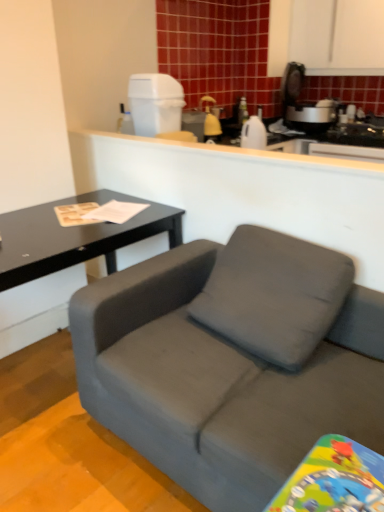
Question: Is matte yellow spray bottle at upper center, the 2th appliance from the front, in front of matte gray couch at center?

Choices:
 (A) no
 (B) yes

Answer: (A)

Question: Does matte yellow spray bottle at upper center, the first appliance from the right, have a lesser width compared to matte gray couch at center?

Choices:
 (A) no
 (B) yes

Answer: (B)

Question: Considering the relative positions of matte yellow spray bottle at upper center, which appears as the 2th appliance when viewed from the left, and matte gray couch at center in the image provided, is matte yellow spray bottle at upper center, which appears as the 2th appliance when viewed from the left, behind matte gray couch at center?

Choices:
 (A) yes
 (B) no

Answer: (A)

Question: Is matte yellow spray bottle at upper center, acting as the 1th appliance starting from the back, next to matte gray couch at center and touching it?

Choices:
 (A) yes
 (B) no

Answer: (B)

Question: From a real-world perspective, is matte yellow spray bottle at upper center, which appears as the 2th appliance when viewed from the left, below matte gray couch at center?

Choices:
 (A) yes
 (B) no

Answer: (B)

Question: From the image's perspective, is matte gray couch at center above or below white plastic trash can at upper center, positioned as the 1th appliance in left-to-right order?

Choices:
 (A) above
 (B) below

Answer: (B)

Question: From a real-world perspective, is matte gray couch at center physically located above or below white plastic trash can at upper center, positioned as the 1th appliance in left-to-right order?

Choices:
 (A) below
 (B) above

Answer: (A)

Question: Is matte gray couch at center bigger or smaller than white plastic trash can at upper center, which is counted as the 1th appliance, starting from the front?

Choices:
 (A) big
 (B) small

Answer: (A)

Question: Is matte gray couch at center inside or outside of white plastic trash can at upper center, placed as the second appliance when sorted from back to front?

Choices:
 (A) outside
 (B) inside

Answer: (A)

Question: From the image's perspective, is black matte table at left above or below matte yellow spray bottle at upper center, which appears as the 2th appliance when viewed from the left?

Choices:
 (A) above
 (B) below

Answer: (B)

Question: Looking at their shapes, would you say black matte table at left is wider or thinner than matte yellow spray bottle at upper center, the 2th appliance from the front?

Choices:
 (A) thin
 (B) wide

Answer: (B)

Question: From a real-world perspective, is black matte table at left above or below matte yellow spray bottle at upper center, which appears as the 2th appliance when viewed from the left?

Choices:
 (A) above
 (B) below

Answer: (B)

Question: Is point (52, 207) positioned closer to the camera than point (206, 114)?

Choices:
 (A) closer
 (B) farther

Answer: (A)

Question: Considering their positions, is white matte counter at upper center located in front of or behind black matte table at left?

Choices:
 (A) front
 (B) behind

Answer: (B)

Question: Do you think white matte counter at upper center is within black matte table at left, or outside of it?

Choices:
 (A) outside
 (B) inside

Answer: (A)